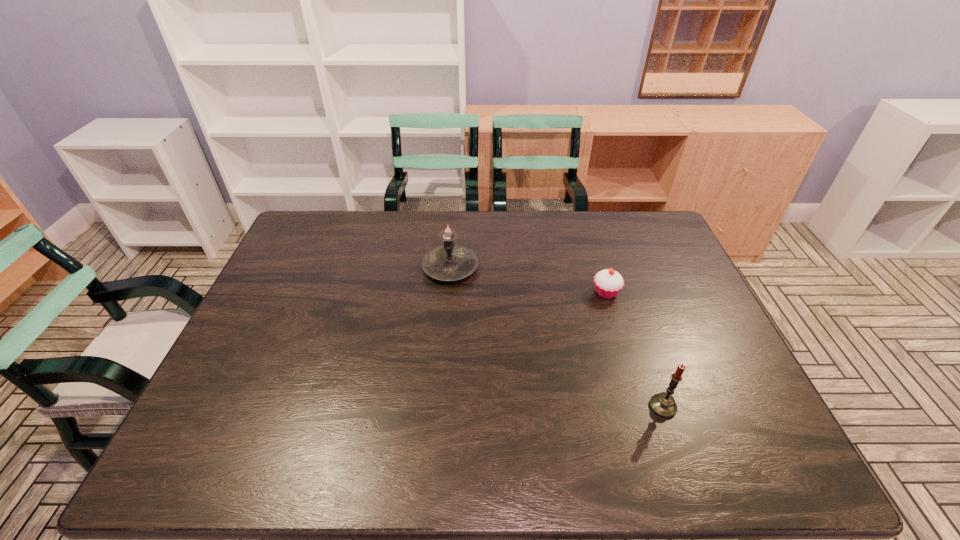
Locate an element on the screen. This screenshot has width=960, height=540. empty location between the leftmost object and the nearer candle is located at coordinates (557, 338).

The width and height of the screenshot is (960, 540). What are the coordinates of `vacant area that lies between the cupcake and the farther candle` in the screenshot? It's located at (528, 280).

The image size is (960, 540). What are the coordinates of `vacant area that lies between the farther candle and the nearest object` in the screenshot? It's located at (557, 338).

Find the location of a particular element. vacant space that's between the right candle and the cupcake is located at coordinates (635, 349).

This screenshot has height=540, width=960. I want to click on vacant space that is in between the nearest object and the shortest object, so click(x=635, y=349).

Where is `the second closest object to the farther candle`? The height and width of the screenshot is (540, 960). the second closest object to the farther candle is located at coordinates (663, 404).

The image size is (960, 540). I want to click on the closest object to the farther candle, so click(x=608, y=283).